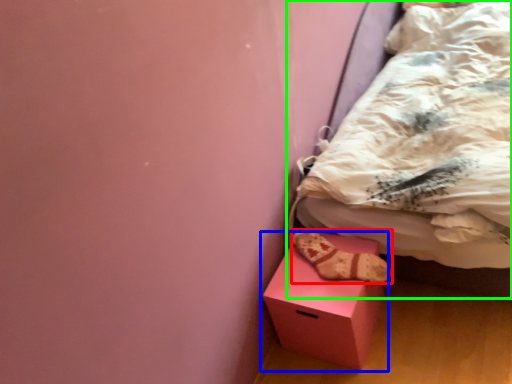
Question: Considering the real-world distances, which object is farthest from footwear (highlighted by a red box)? box (highlighted by a blue box) or bed (highlighted by a green box)?

Choices:
 (A) box
 (B) bed

Answer: (B)